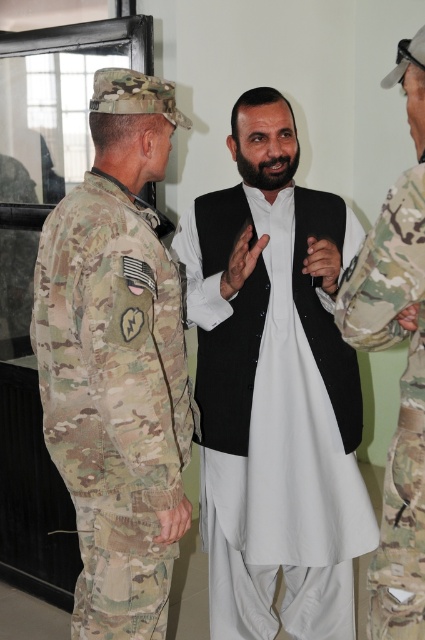
Question: Does black cotton vest at center have a greater width compared to camouflage fabric uniform at left?

Choices:
 (A) no
 (B) yes

Answer: (B)

Question: Which object is positioned farthest from the matte black hand at center?

Choices:
 (A) camouflage fabric uniform at left
 (B) matte black phone at center
 (C) black cotton vest at center
 (D) camouflage fabric uniform at right

Answer: (D)

Question: Among these points, which one is farthest from the camera?

Choices:
 (A) (252, 269)
 (B) (289, 550)

Answer: (B)

Question: Does matte black hand at center appear on the left side of matte black phone at center?

Choices:
 (A) no
 (B) yes

Answer: (B)

Question: Based on their relative distances, which object is nearer to the camouflage fabric uniform at right?

Choices:
 (A) matte black hand at center
 (B) camouflage fabric uniform at left

Answer: (B)

Question: From the image, what is the correct spatial relationship of camouflage fabric uniform at left in relation to matte black hand at center?

Choices:
 (A) right
 (B) left

Answer: (B)